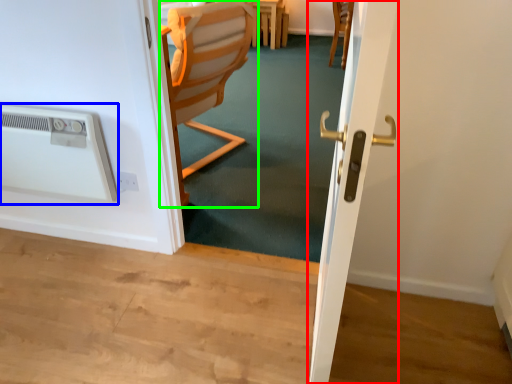
Question: Which object is the closest to the screen door (highlighted by a red box)? Choose among these: air conditioning (highlighted by a blue box) or chair (highlighted by a green box).

Choices:
 (A) air conditioning
 (B) chair

Answer: (B)